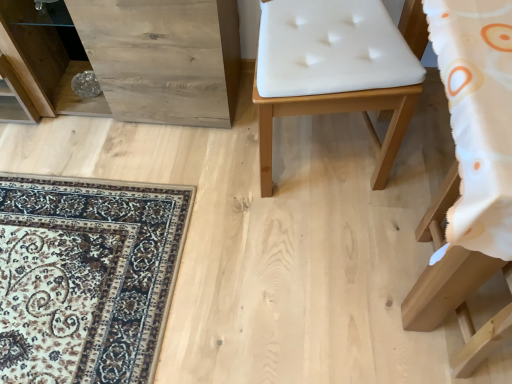
This screenshot has height=384, width=512. Describe the element at coordinates (337, 112) in the screenshot. I see `white leather chair at center, acting as the 2th furniture starting from the right` at that location.

Where is `white leather chair at center, acting as the 2th furniture starting from the right`? This screenshot has width=512, height=384. white leather chair at center, acting as the 2th furniture starting from the right is located at coordinates (337, 112).

Which point is more forward, (454,171) or (268,189)?

The point (268,189) is closer.

Considering the relative positions of white fabric cushion at lower right, which appears as the second furniture when viewed from the left, and white leather chair at center, which is counted as the first furniture, starting from the top, in the image provided, is white fabric cushion at lower right, which appears as the second furniture when viewed from the left, in front of white leather chair at center, which is counted as the first furniture, starting from the top,?

Yes, it is in front of white leather chair at center, which is counted as the first furniture, starting from the top.

Considering the positions of objects white fabric cushion at lower right, which is the 1th furniture in bottom-to-top order, and white leather chair at center, marked as the first furniture in a left-to-right arrangement, in the image provided, who is more to the right, white fabric cushion at lower right, which is the 1th furniture in bottom-to-top order, or white leather chair at center, marked as the first furniture in a left-to-right arrangement,?

white fabric cushion at lower right, which is the 1th furniture in bottom-to-top order.

Does white fabric cushion at lower right, which appears as the second furniture when viewed from the left, have a greater width compared to natural wood dresser at left?

Yes, white fabric cushion at lower right, which appears as the second furniture when viewed from the left, is wider than natural wood dresser at left.

From the picture: From the image's perspective, does white fabric cushion at lower right, which is the 1th furniture in bottom-to-top order, appear higher than natural wood dresser at left?

Actually, white fabric cushion at lower right, which is the 1th furniture in bottom-to-top order, appears below natural wood dresser at left in the image.

From a real-world perspective, is white fabric cushion at lower right, acting as the second furniture starting from the top, beneath natural wood dresser at left?

Yes.

Is white leather chair at center, marked as the first furniture in a left-to-right arrangement, oriented away from white fabric cushion at lower right, acting as the second furniture starting from the top?

No.

From a real-world perspective, is white leather chair at center, which is counted as the first furniture, starting from the top, positioned over white fabric cushion at lower right, which is the first furniture in right-to-left order, based on gravity?

Indeed, from a real-world perspective, white leather chair at center, which is counted as the first furniture, starting from the top, stands above white fabric cushion at lower right, which is the first furniture in right-to-left order.

Between white leather chair at center, which is counted as the first furniture, starting from the top, and white fabric cushion at lower right, acting as the second furniture starting from the top, which one has larger size?

Bigger between the two is white leather chair at center, which is counted as the first furniture, starting from the top.

Considering the relative sizes of white leather chair at center, which is the 2th furniture from bottom to top, and white fabric cushion at lower right, which appears as the second furniture when viewed from the left, in the image provided, is white leather chair at center, which is the 2th furniture from bottom to top, taller than white fabric cushion at lower right, which appears as the second furniture when viewed from the left,?

Yes, white leather chair at center, which is the 2th furniture from bottom to top, is taller than white fabric cushion at lower right, which appears as the second furniture when viewed from the left.

In the scene shown: From the image's perspective, which one is positioned higher, white leather chair at center, which is the 2th furniture from bottom to top, or natural wood dresser at left?

natural wood dresser at left, from the image's perspective.

Is point (309, 110) positioned behind point (210, 102)?

No, it is in front of (210, 102).

How distant is white leather chair at center, acting as the 2th furniture starting from the right, from natural wood dresser at left?

They are 23.25 inches apart.

Relative to white fabric cushion at lower right, which is the 1th furniture in bottom-to-top order, is natural wood dresser at left in front or behind?

Visually, natural wood dresser at left is located behind white fabric cushion at lower right, which is the 1th furniture in bottom-to-top order.

Can you confirm if natural wood dresser at left is taller than white fabric cushion at lower right, acting as the second furniture starting from the top?

Indeed, natural wood dresser at left has a greater height compared to white fabric cushion at lower right, acting as the second furniture starting from the top.

Are natural wood dresser at left and white fabric cushion at lower right, acting as the second furniture starting from the top, located far from each other?

natural wood dresser at left is far away from white fabric cushion at lower right, acting as the second furniture starting from the top.

From a real-world perspective, is natural wood dresser at left below white leather chair at center, marked as the first furniture in a left-to-right arrangement?

Yes, from a real-world perspective, natural wood dresser at left is beneath white leather chair at center, marked as the first furniture in a left-to-right arrangement.

The image size is (512, 384). In the image, there is a white leather chair at center, marked as the first furniture in a left-to-right arrangement. Find the location of `dresser below it (from a real-world perspective)`. dresser below it (from a real-world perspective) is located at coordinates (131, 58).

Which of these two, natural wood dresser at left or white leather chair at center, marked as the first furniture in a left-to-right arrangement, is wider?

Wider between the two is white leather chair at center, marked as the first furniture in a left-to-right arrangement.

Where is `furniture above the white fabric cushion at lower right, which appears as the second furniture when viewed from the left (from the image's perspective)`? This screenshot has height=384, width=512. furniture above the white fabric cushion at lower right, which appears as the second furniture when viewed from the left (from the image's perspective) is located at coordinates (337, 112).

Where is `dresser on the left of the white fabric cushion at lower right, which appears as the second furniture when viewed from the left`? The image size is (512, 384). dresser on the left of the white fabric cushion at lower right, which appears as the second furniture when viewed from the left is located at coordinates (131, 58).

Which object lies further to the anchor point white fabric cushion at lower right, which is the 1th furniture in bottom-to-top order, white leather chair at center, which is the 2th furniture from bottom to top, or natural wood dresser at left?

The object further to white fabric cushion at lower right, which is the 1th furniture in bottom-to-top order, is natural wood dresser at left.

Looking at the image, which one is located closer to natural wood dresser at left, white leather chair at center, marked as the first furniture in a left-to-right arrangement, or white fabric cushion at lower right, acting as the second furniture starting from the top?

white leather chair at center, marked as the first furniture in a left-to-right arrangement, is closer to natural wood dresser at left.

From the picture: From the image, which object appears to be farther from natural wood dresser at left, white fabric cushion at lower right, which is the 1th furniture in bottom-to-top order, or white leather chair at center, marked as the first furniture in a left-to-right arrangement?

white fabric cushion at lower right, which is the 1th furniture in bottom-to-top order, lies further to natural wood dresser at left than the other object.

In the scene shown: When comparing their distances from white leather chair at center, which is the 2th furniture from bottom to top, does natural wood dresser at left or white fabric cushion at lower right, which is the first furniture in right-to-left order, seem further?

natural wood dresser at left lies further to white leather chair at center, which is the 2th furniture from bottom to top, than the other object.

Looking at the image, which one is located closer to white fabric cushion at lower right, which is the first furniture in right-to-left order, natural wood dresser at left or white leather chair at center, which is counted as the first furniture, starting from the top?

Based on the image, white leather chair at center, which is counted as the first furniture, starting from the top, appears to be nearer to white fabric cushion at lower right, which is the first furniture in right-to-left order.

Based on the photo, when comparing their distances from white leather chair at center, marked as the first furniture in a left-to-right arrangement, does white fabric cushion at lower right, which is the first furniture in right-to-left order, or natural wood dresser at left seem closer?

white fabric cushion at lower right, which is the first furniture in right-to-left order.

The width and height of the screenshot is (512, 384). What are the coordinates of `furniture between natural wood dresser at left and white fabric cushion at lower right, which is the 1th furniture in bottom-to-top order` in the screenshot? It's located at (337, 112).